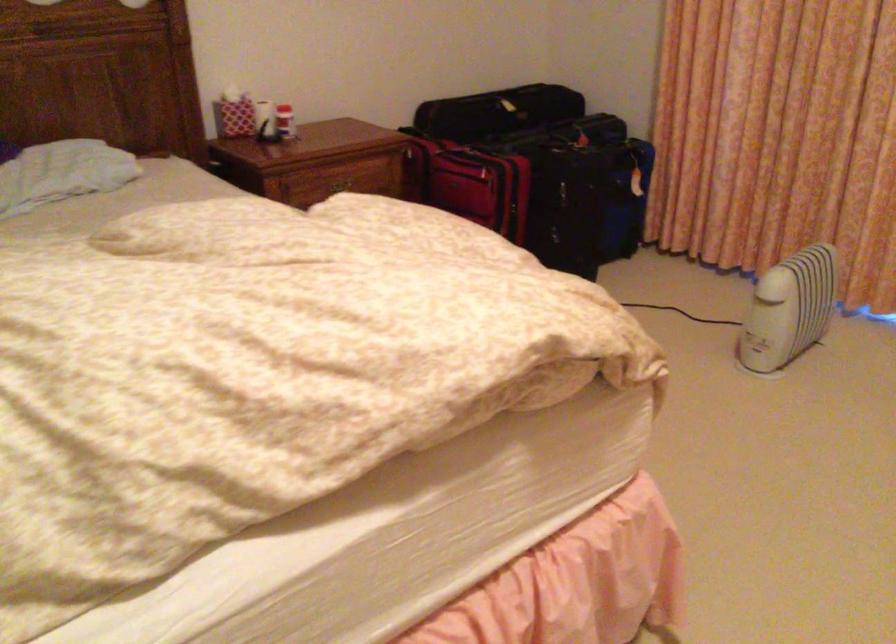
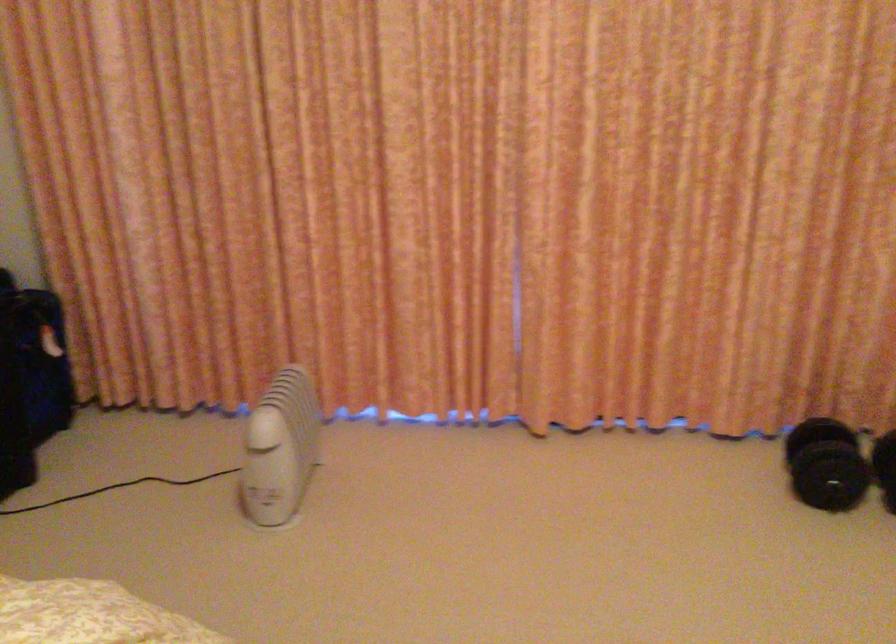
Question: How did the camera likely rotate?

Choices:
 (A) Left
 (B) Right
 (C) Up
 (D) Down

Answer: (B)